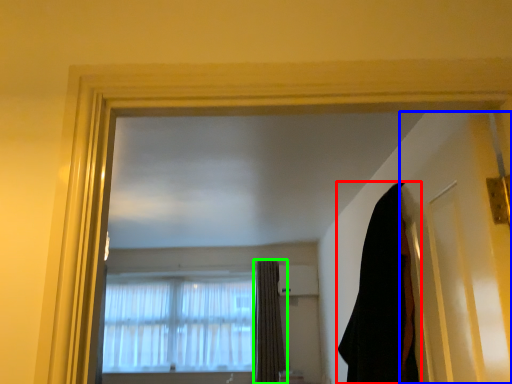
Question: Which is nearer to the curtain (highlighted by a red box)? door (highlighted by a blue box) or curtain (highlighted by a green box).

Choices:
 (A) door
 (B) curtain

Answer: (A)